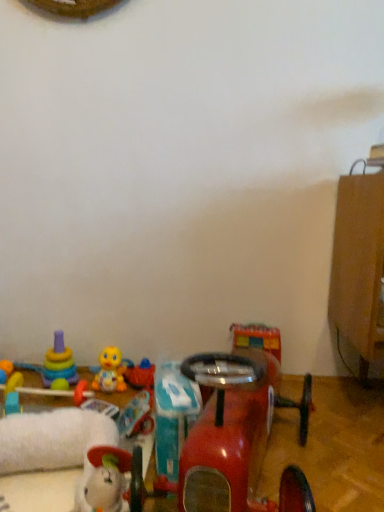
At what (x,y) coordinates should I click in order to perform the action: click on empty space that is ontop of teal plastic toy at center, marked as the 2th toy in a right-to-left arrangement (from a real-world perspective). Please return your answer as a coordinate pair (x, y). This screenshot has height=512, width=384. Looking at the image, I should click on (182, 391).